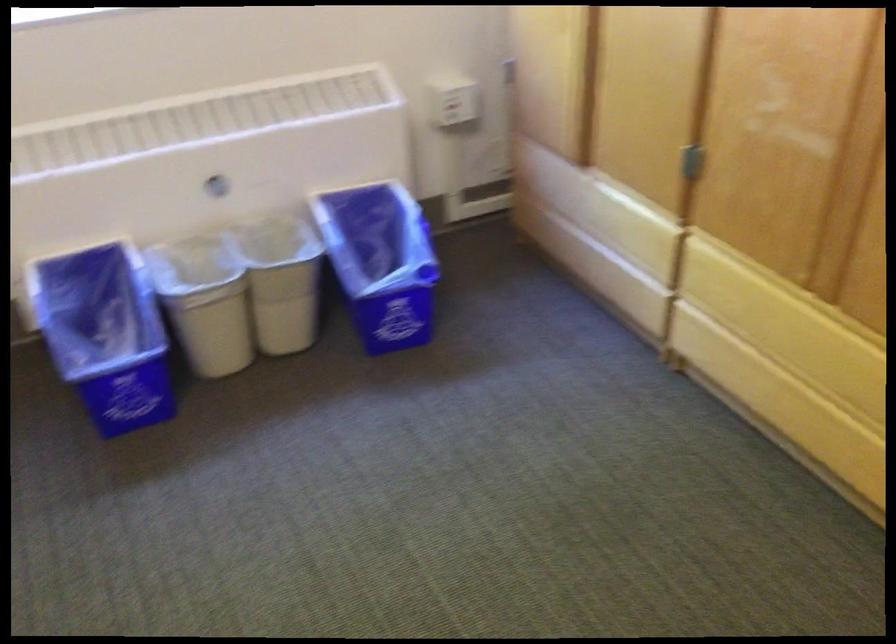
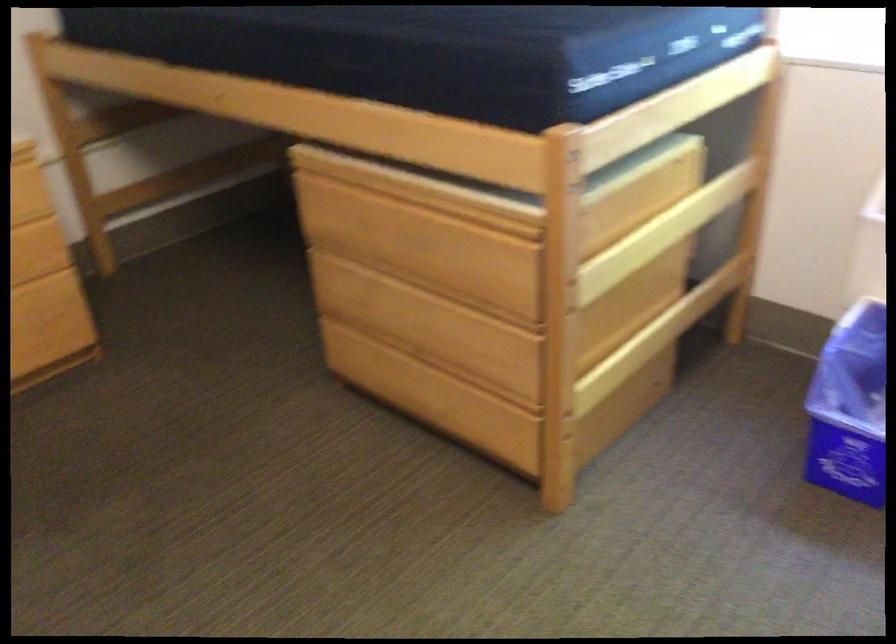
First-person continuous shooting, in which direction is the camera rotating?

The camera's rotation is toward left-down.